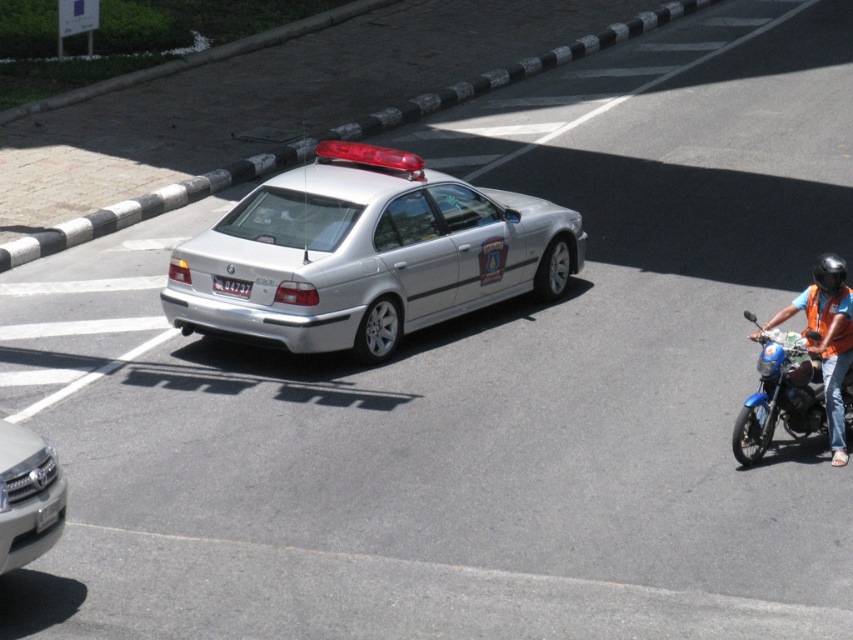
How much distance is there between silver metallic sedan at center and black plastic license plate at center?

1.18 meters

Between silver metallic sedan at center and black plastic license plate at center, which one is positioned higher?

silver metallic sedan at center

Where is `silver metallic sedan at center`? The image size is (853, 640). silver metallic sedan at center is located at coordinates (367, 253).

This screenshot has width=853, height=640. I want to click on silver metallic sedan at center, so click(x=367, y=253).

Does silver metallic sedan at center have a greater width compared to orange reflective vest at right?

Yes.

I want to click on silver metallic sedan at center, so click(367, 253).